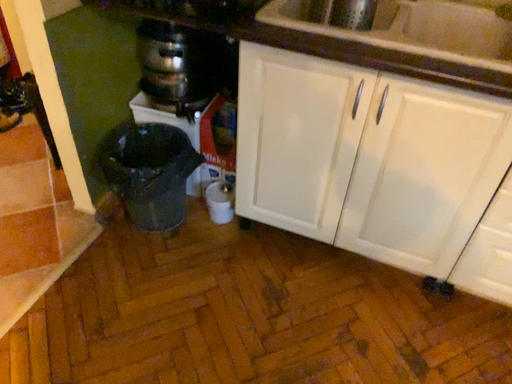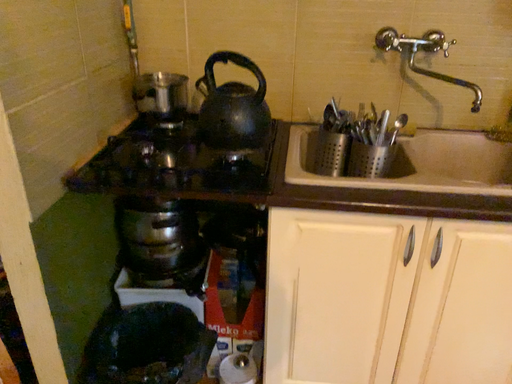
Question: How did the camera likely rotate when shooting the video?

Choices:
 (A) rotated right
 (B) rotated left

Answer: (A)